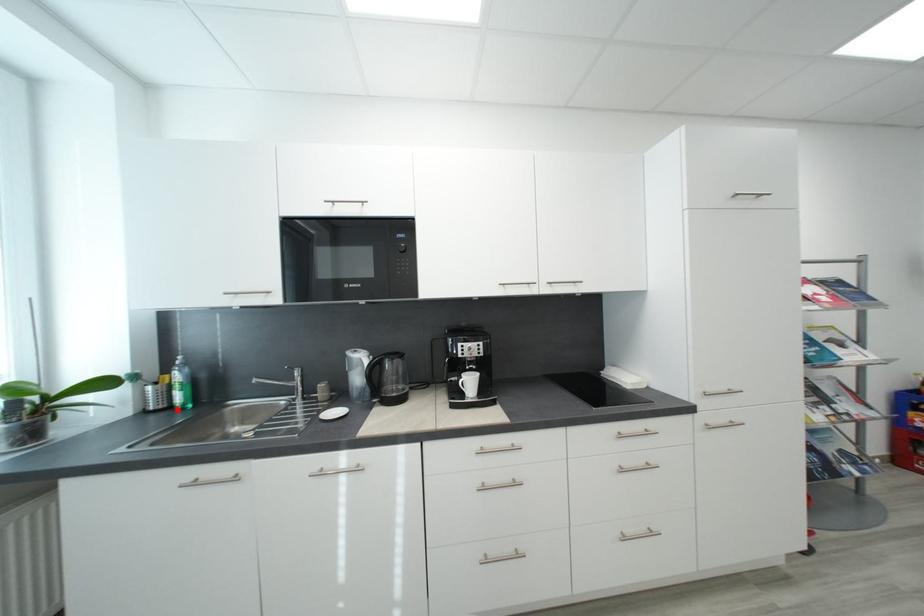
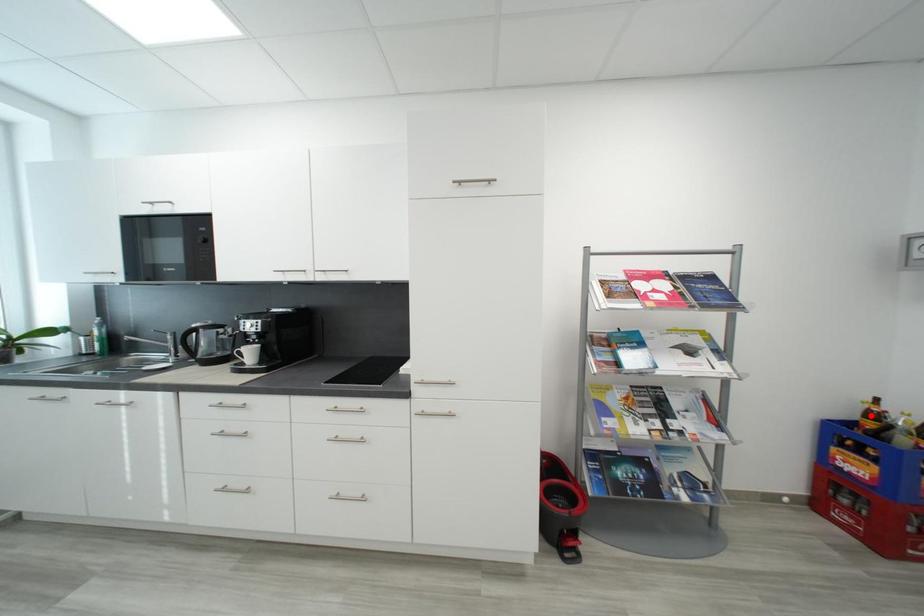
I am providing you with two images of the same scene from different viewpoints. A red point is marked on the first image and another point is marked on the second image. Do the highlighted points in image1 and image2 indicate the same real-world spot?

No